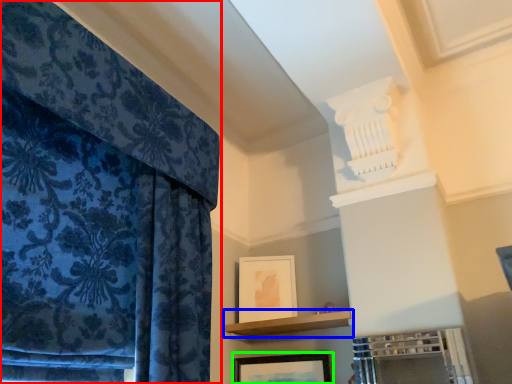
Question: Which object is the closest to the curtain (highlighted by a red box)? Choose among these: shelf (highlighted by a blue box) or picture frame (highlighted by a green box).

Choices:
 (A) shelf
 (B) picture frame

Answer: (A)